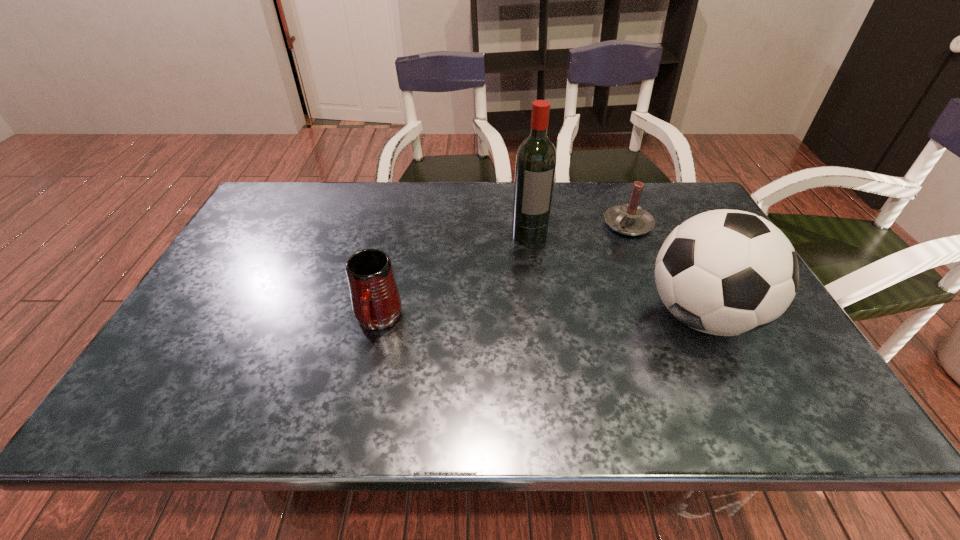
Where is `the leftmost object`? The width and height of the screenshot is (960, 540). the leftmost object is located at coordinates (376, 303).

Find the location of `soccer ball`. soccer ball is located at coordinates (724, 272).

Locate an element on the screen. candle is located at coordinates (630, 219).

Locate an element on the screen. Image resolution: width=960 pixels, height=540 pixels. the tallest object is located at coordinates (536, 158).

Find the location of a particular element. The height and width of the screenshot is (540, 960). the second object from left to right is located at coordinates (536, 158).

Locate an element on the screen. The height and width of the screenshot is (540, 960). blank area located on the left of the third shortest object is located at coordinates (615, 315).

The image size is (960, 540). Find the location of `vacant space located 0.300m on the side of the candle with the handle loop`. vacant space located 0.300m on the side of the candle with the handle loop is located at coordinates (558, 288).

What are the coordinates of `vacant area located on the side of the candle with the handle loop` in the screenshot? It's located at (571, 277).

At what (x,y) coordinates should I click in order to perform the action: click on vacant area situated 0.130m on the side of the candle with the handle loop. Please return your answer as a coordinate pair (x, y). This screenshot has width=960, height=540. Looking at the image, I should click on (592, 257).

The width and height of the screenshot is (960, 540). I want to click on free region located on the label of the second object from left to right, so click(x=537, y=257).